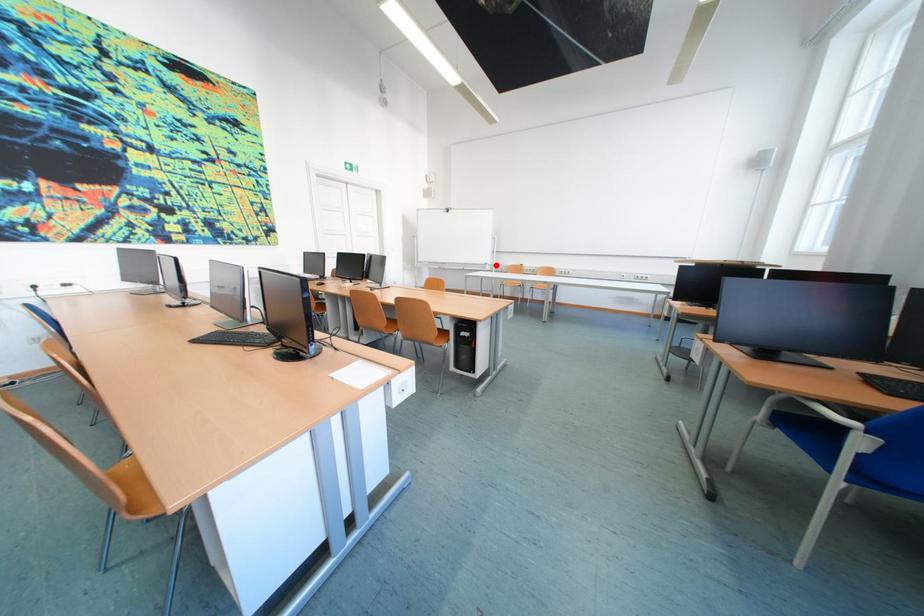
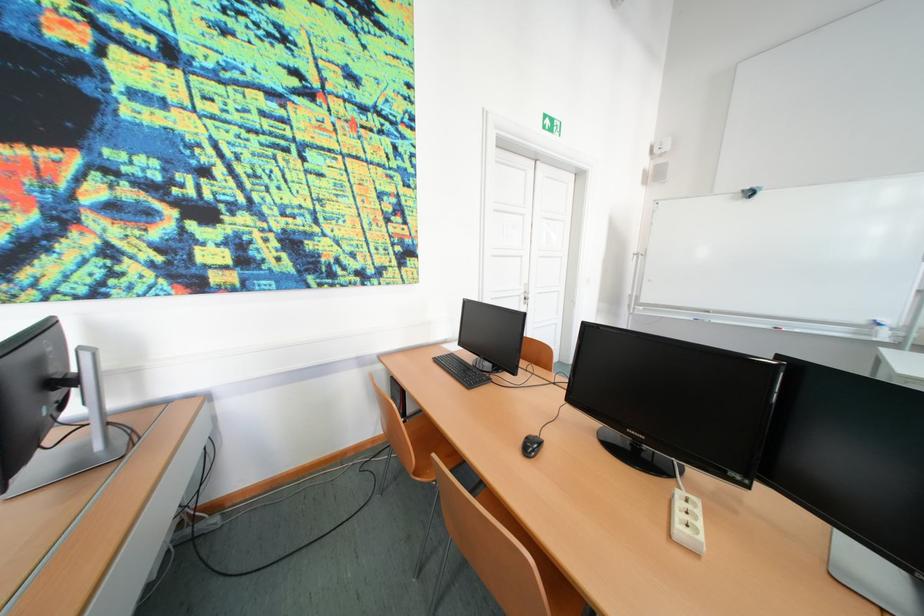
Find the pixel in the second image that matches the highlighted location in the first image.

(874, 323)